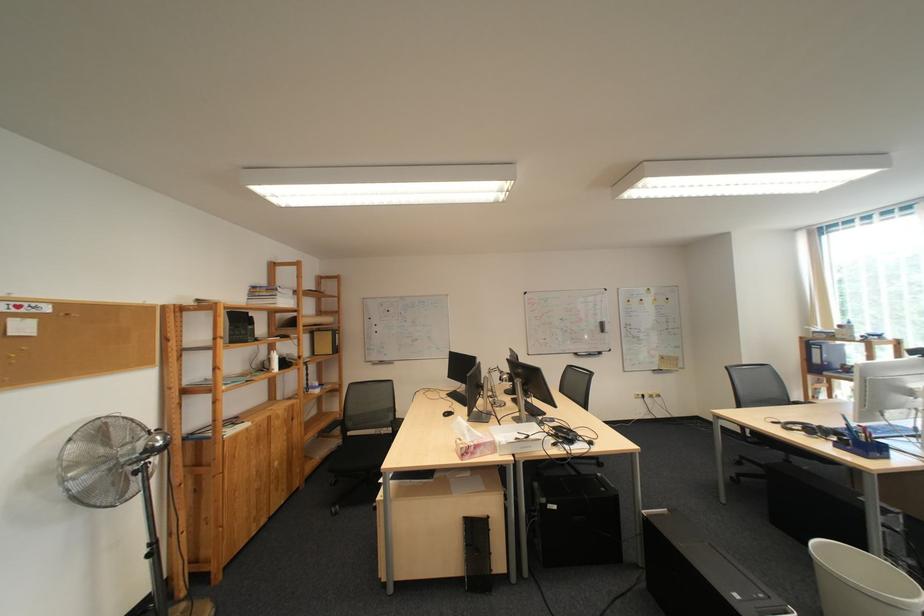
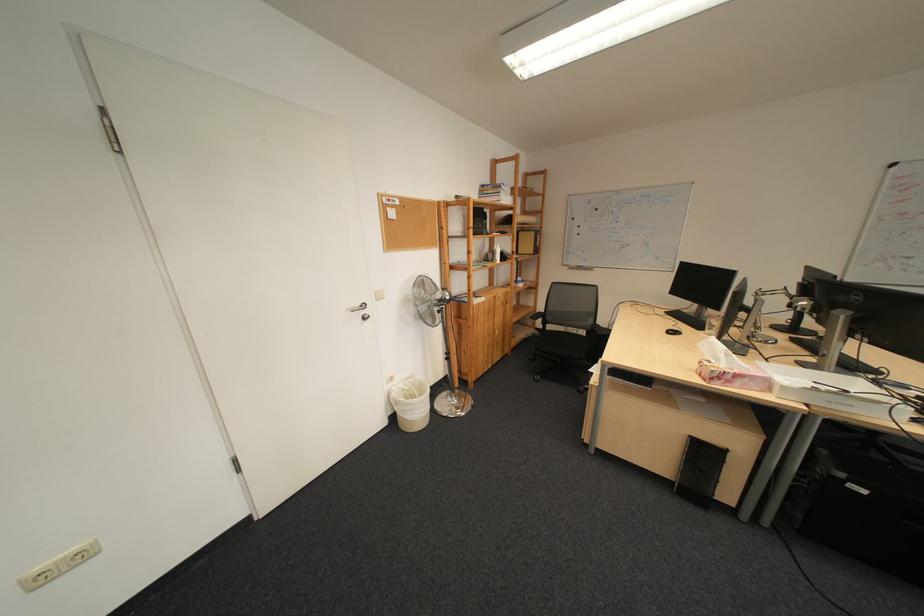
The point at (354,448) is marked in the first image. Where is the corresponding point in the second image?

(548, 336)